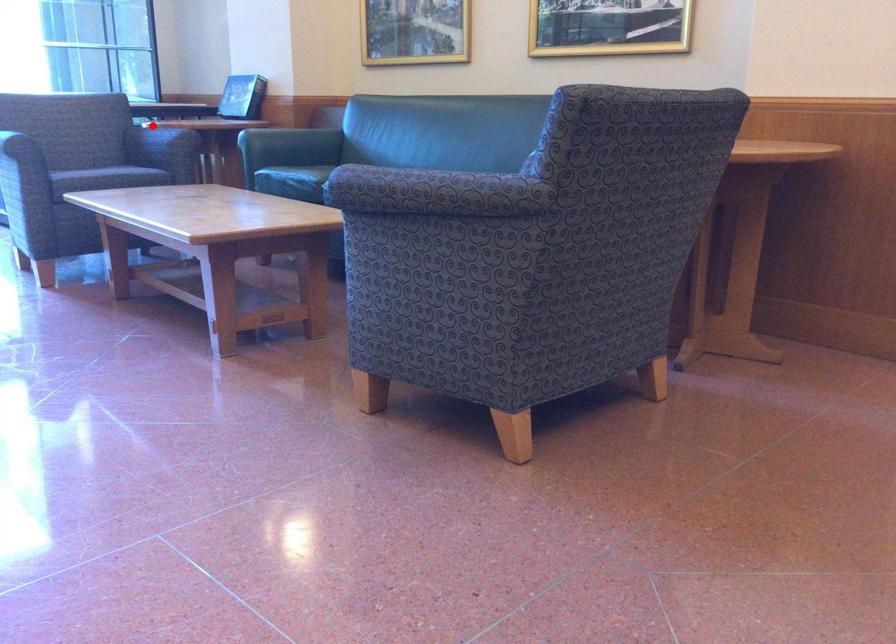
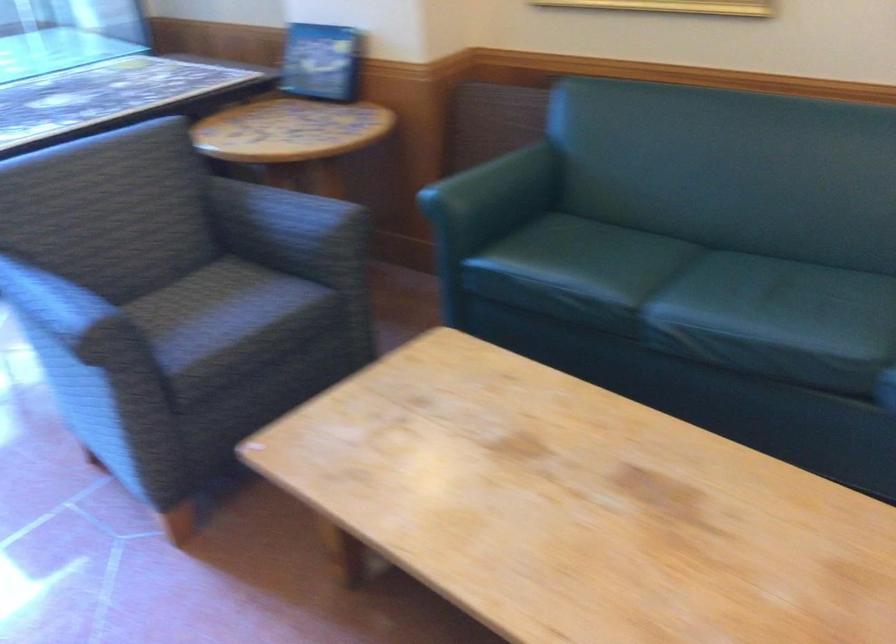
Locate, in the second image, the point that corresponds to the highlighted location in the first image.

(287, 211)